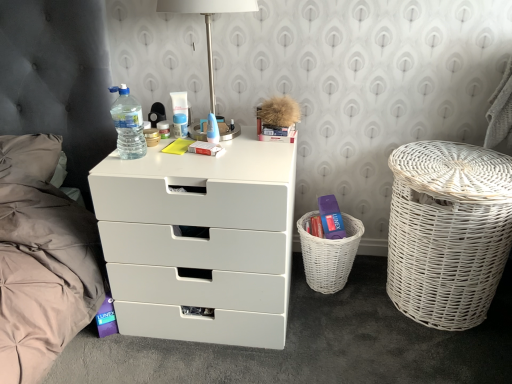
This screenshot has height=384, width=512. I want to click on spots to the right of translucent plastic tube at center, the first toiletry in the left-to-right sequence, so click(x=203, y=132).